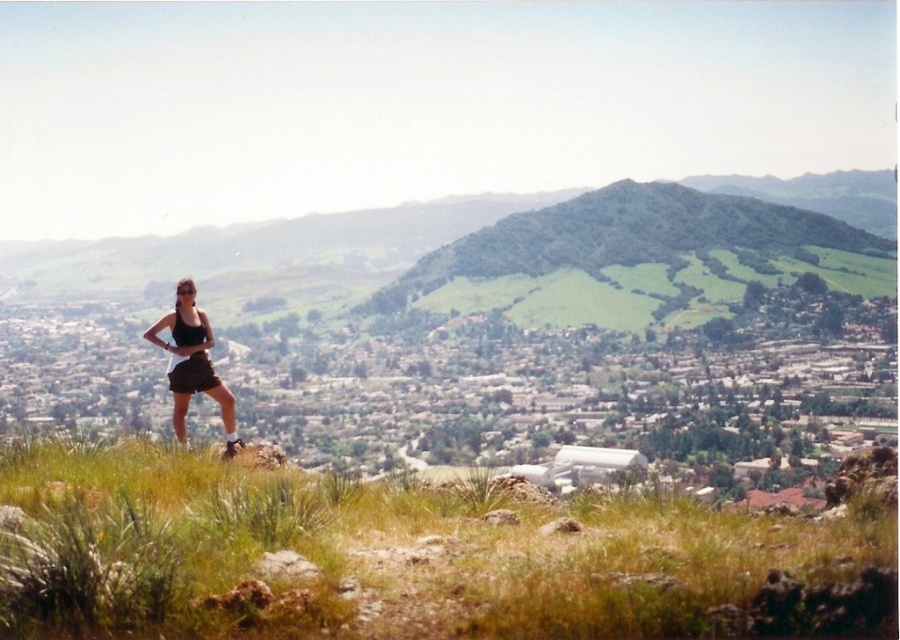
From the picture: You are a photographer trying to capture the scene with a wide angle lens. You notice the green grassy at left and the black matte shorts at center in your viewfinder. Which object is positioned more to the right side of the frame?

The green grassy at left is positioned to the right of the black matte shorts at center, so the green grassy at left is more to the right side of the frame.

You are planning to take a photo of the green grassy at left and the black matte shorts at center. Since you want both to be in focus, which object should you adjust your camera focus to prioritize to ensure both are sharp? Explain your reasoning based on their sizes in the image.

The green grassy at left is wider than the black matte shorts at center. To ensure both are in focus, prioritize focusing on the smaller object, the black matte shorts at center, as it requires less depth of field to capture its details. However, since the green grassy at left is wider, you might need a smaller aperture setting to increase depth of field and keep both in focus.